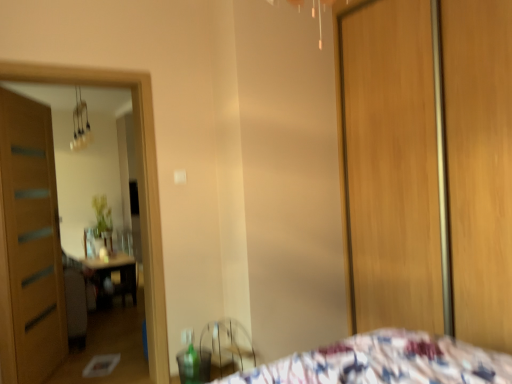
Question: Does wooden screen door at right appear on the right side of wooden door at left?

Choices:
 (A) no
 (B) yes

Answer: (B)

Question: Does wooden screen door at right come behind wooden door at left?

Choices:
 (A) no
 (B) yes

Answer: (A)

Question: Considering the relative positions of wooden screen door at right and wooden door at left in the image provided, is wooden screen door at right in front of wooden door at left?

Choices:
 (A) no
 (B) yes

Answer: (B)

Question: From the image's perspective, is wooden screen door at right below wooden door at left?

Choices:
 (A) no
 (B) yes

Answer: (A)

Question: Is wooden screen door at right not within wooden door at left?

Choices:
 (A) no
 (B) yes

Answer: (B)

Question: Based on their sizes in the image, would you say metallic glass chandelier at upper left is bigger or smaller than wooden screen door at right?

Choices:
 (A) small
 (B) big

Answer: (A)

Question: From the image's perspective, is metallic glass chandelier at upper left above or below wooden screen door at right?

Choices:
 (A) above
 (B) below

Answer: (A)

Question: Is metallic glass chandelier at upper left in front of or behind wooden screen door at right in the image?

Choices:
 (A) behind
 (B) front

Answer: (A)

Question: Based on their positions, is metallic glass chandelier at upper left located to the left or right of wooden screen door at right?

Choices:
 (A) left
 (B) right

Answer: (A)

Question: Considering the relative positions of wooden door at left and wooden screen door at right in the image provided, is wooden door at left to the left or to the right of wooden screen door at right?

Choices:
 (A) right
 (B) left

Answer: (B)

Question: In the image, is wooden door at left positioned in front of or behind wooden screen door at right?

Choices:
 (A) behind
 (B) front

Answer: (A)

Question: From the image's perspective, relative to wooden screen door at right, is wooden door at left above or below?

Choices:
 (A) above
 (B) below

Answer: (B)

Question: Does point (7, 230) appear closer or farther from the camera than point (507, 147)?

Choices:
 (A) farther
 (B) closer

Answer: (A)

Question: In terms of width, does metallic glass chandelier at upper left look wider or thinner when compared to wooden door at left?

Choices:
 (A) wide
 (B) thin

Answer: (A)

Question: Does point (80, 147) appear closer or farther from the camera than point (45, 337)?

Choices:
 (A) farther
 (B) closer

Answer: (A)